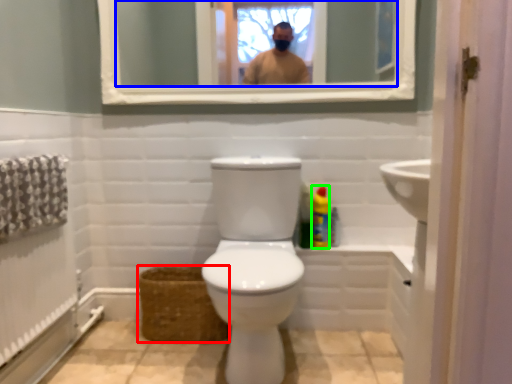
Question: Considering the real-world distances, which object is closest to basket (highlighted by a red box)? mirror (highlighted by a blue box) or cleaning product (highlighted by a green box).

Choices:
 (A) mirror
 (B) cleaning product

Answer: (B)